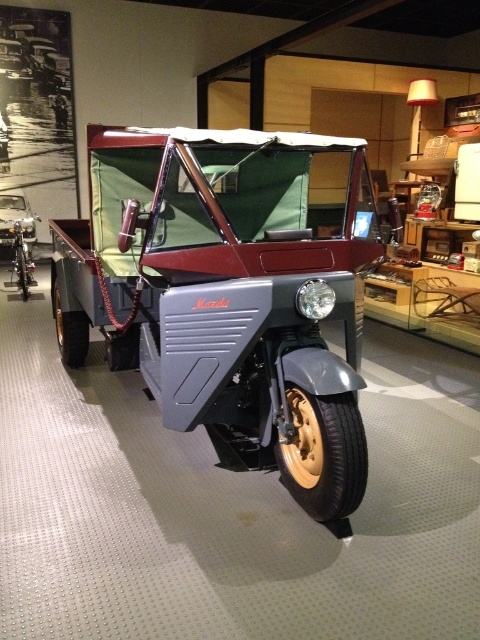
Question: Is metallic gray jeep at center thinner than shiny silver car at left?

Choices:
 (A) no
 (B) yes

Answer: (A)

Question: Can you confirm if metallic gray jeep at center is positioned below shiny silver car at left?

Choices:
 (A) no
 (B) yes

Answer: (B)

Question: Among these objects, which one is farthest from the camera?

Choices:
 (A) metallic gray jeep at center
 (B) shiny silver car at left

Answer: (B)

Question: Which point is closer to the camera taking this photo?

Choices:
 (A) (326, 384)
 (B) (7, 192)

Answer: (A)

Question: Where is metallic gray jeep at center located in relation to shiny silver car at left in the image?

Choices:
 (A) right
 (B) left

Answer: (A)